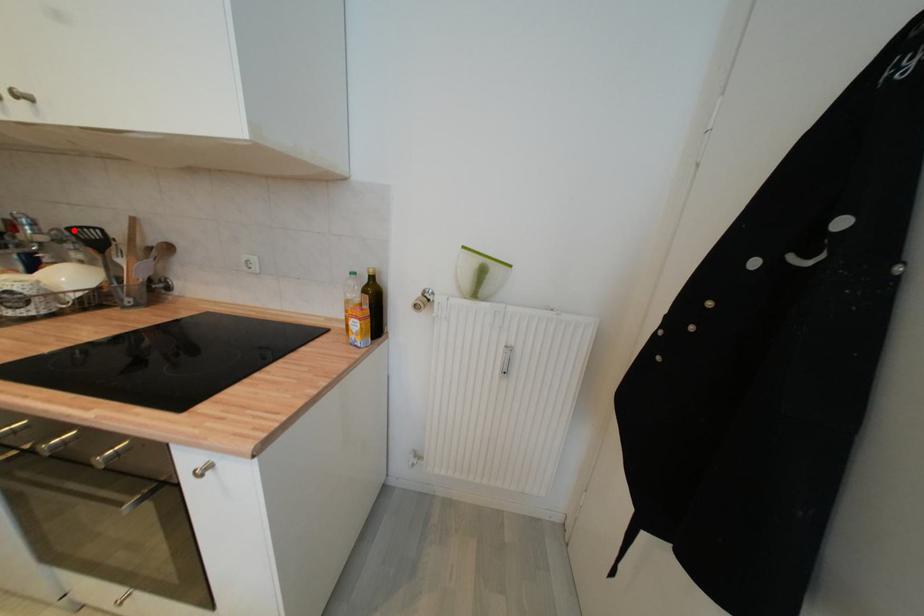
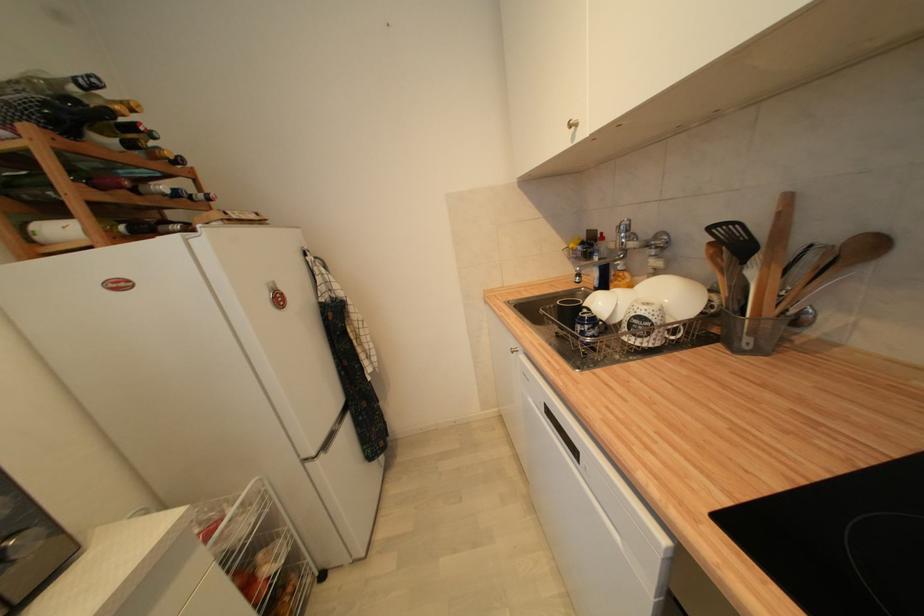
In the second image, find the point that corresponds to the highlighted location in the first image.

(715, 230)